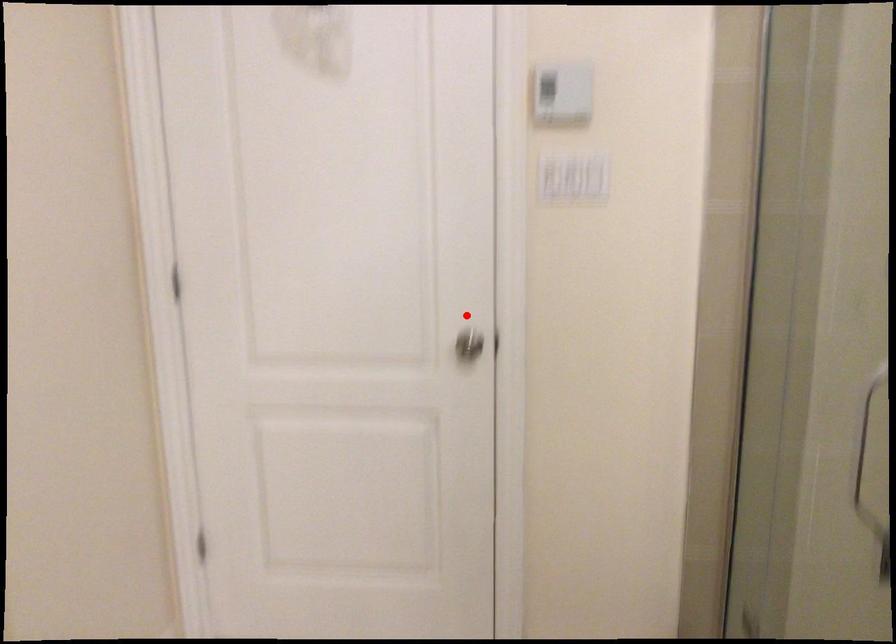
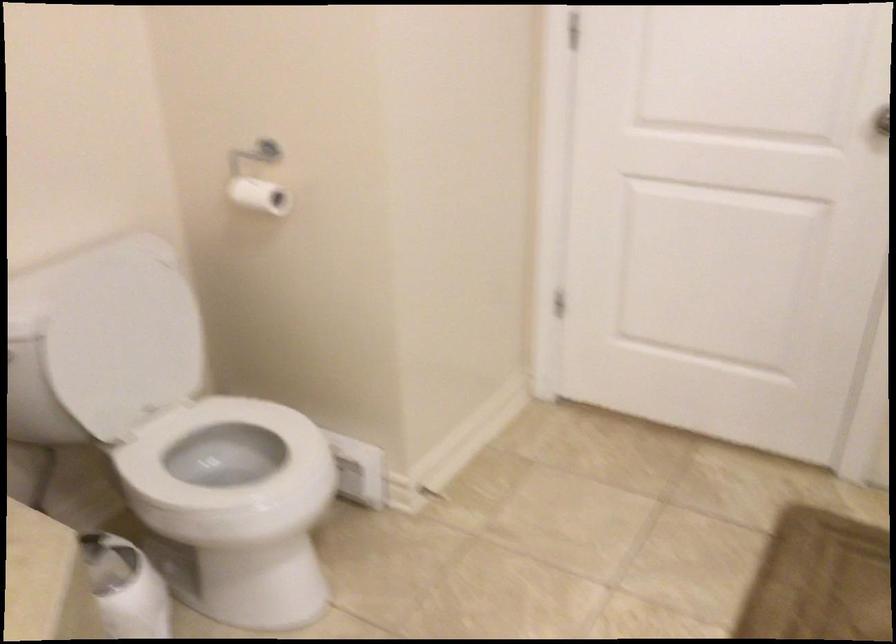
Locate, in the second image, the point that corresponds to the highlighted location in the first image.

(879, 131)